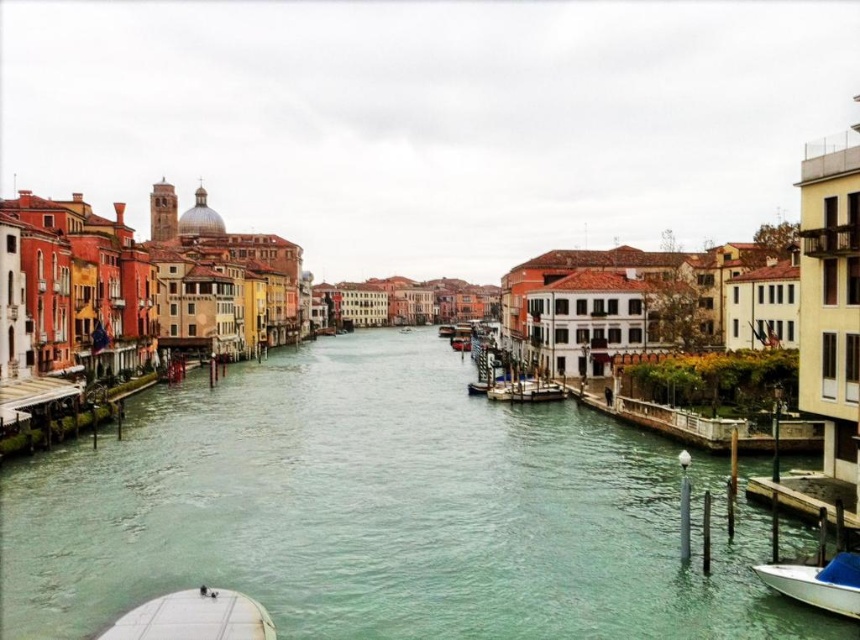
You are standing on the dock and see a point marked at coordinates (382,513). What is the location of this point relative to the greenish water at center?

The point at (382,513) is located on the greenish water at center.

You are a tourist standing on the bridge overlooking the canal. You see the greenish water at center and the wooden boat at center. Which object is closer to you?

The greenish water at center is closer to the viewer than the wooden boat at center.

You are a tourist standing on the bridge overlooking the canal. You see the white matte boat at lower right and the wooden boat at center. If you want to take a photo that includes both boats, which boat should you focus on to ensure both are in the frame?

To include both the white matte boat at lower right and the wooden boat at center in your photo, focus on the wooden boat at center since the white matte boat at lower right is 775.66 feet away from it, so keeping the wooden boat at center as the central point would allow the camera to capture both within the frame.